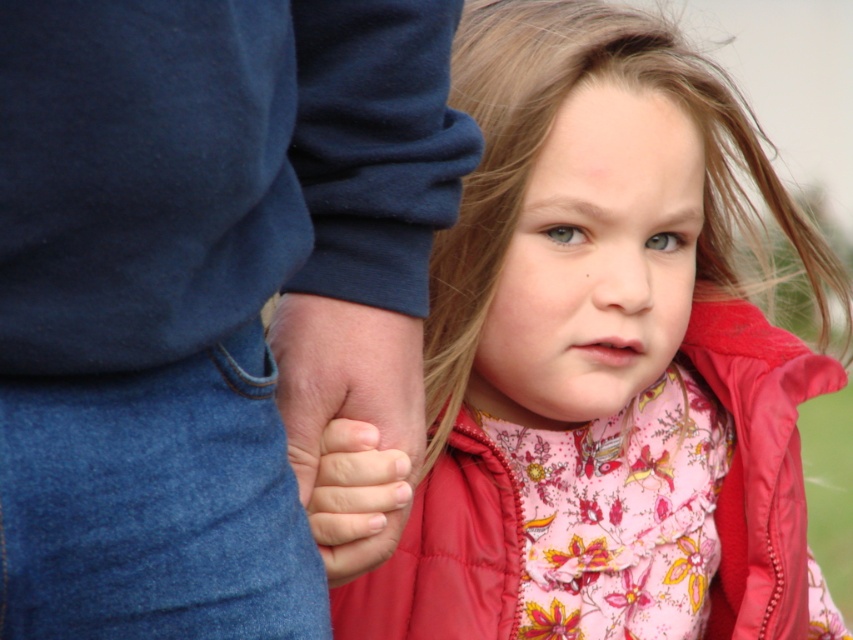
Does point (718, 369) lie in front of point (326, 522)?

That is False.

Is point (450, 568) closer to camera compared to point (328, 576)?

No, it is behind (328, 576).

The image size is (853, 640). I want to click on floral fabric dress at center, so click(x=590, y=365).